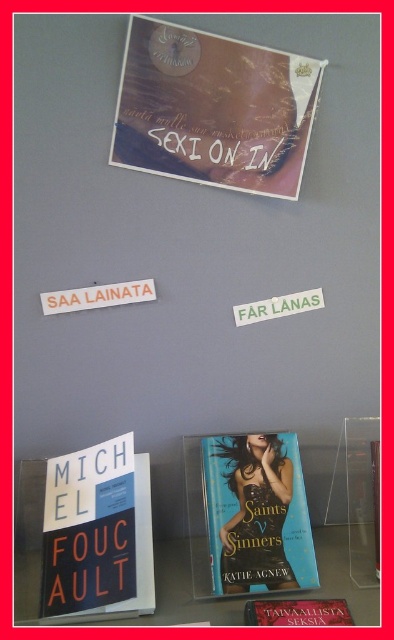
You are a librarian who needs to place a new book that is 20 inches tall onto the shelf between the matte brown book cover at upper center and the teal glossy paperback book at center. Can the book fit in the space between them?

The distance between the matte brown book cover at upper center and the teal glossy paperback book at center is 22.87 inches. Since the new book is 20 inches tall, it can fit in the space between them as there is enough room.

You are organizing a bookshelf and need to place the teal glossy paperback book at center and the blue glossy book at lower center side by side. Which book should you place on the left to ensure they fit without overlapping?

Since the teal glossy paperback book at center is wider than the blue glossy book at lower center, you should place the teal glossy paperback book at center on the left to accommodate its larger width, ensuring there is enough space between them.

You are a customer looking at the teal glossy paperback book at center and the blue glossy book at lower center. Which one is closer to you?

The teal glossy paperback book at center is closer to you because the blue glossy book at lower center is behind it.